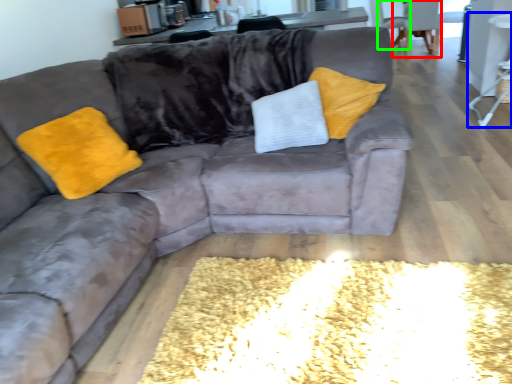
Question: Considering the real-world distances, which object is closest to armchair (highlighted by a red box)? side table (highlighted by a blue box) or armchair (highlighted by a green box).

Choices:
 (A) side table
 (B) armchair

Answer: (B)